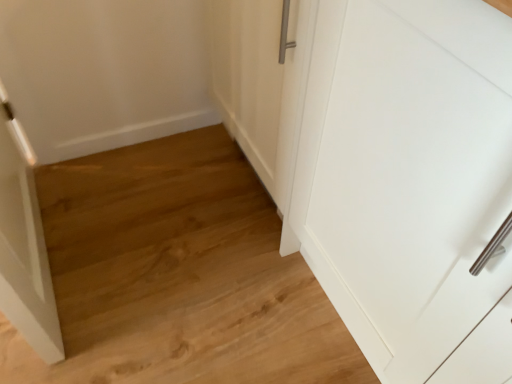
Question: Should I look upward or downward to see white matte cupboard at right?

Choices:
 (A) up
 (B) down

Answer: (B)